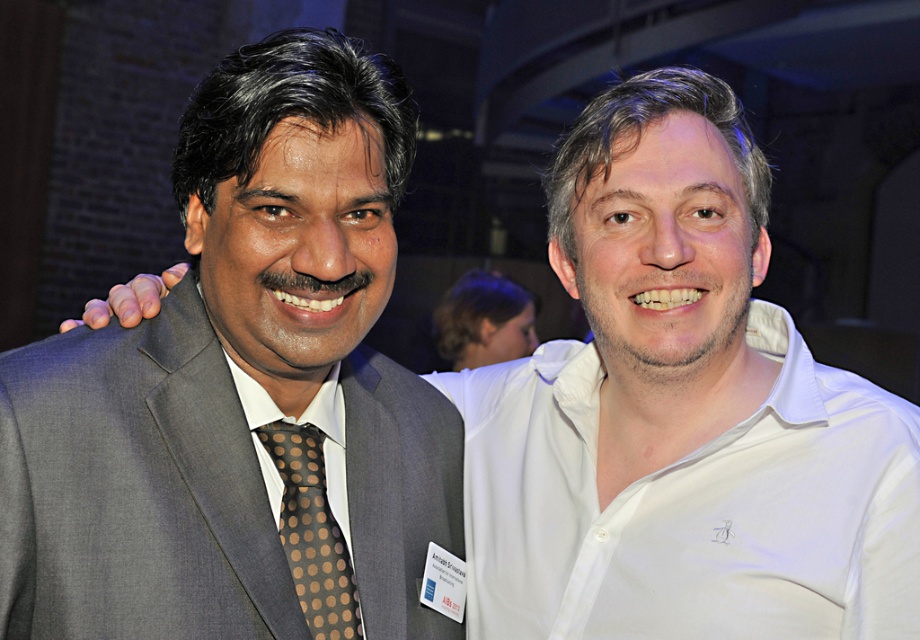
You are standing in a room and see two points marked on the wall. The first point is at coordinates point [99,365] and the second is at point [295,496]. Which point is closer to you?

Point [99,365] is in front of point [295,496], so it is closer to you.

You are at the center of the image and need to determine the position of the gray fabric suit at left relative to your current location. Is it to your left or right side?

The gray fabric suit at left is located at point (x=135, y=490), which means it is to your left side.